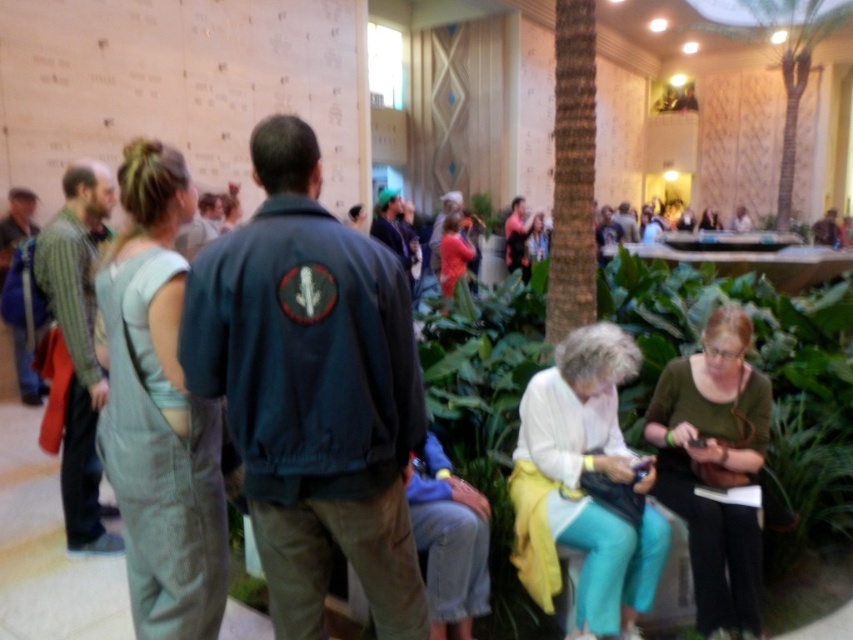
Question: Which object is the farthest from the green fabric purse at lower right?

Choices:
 (A) matte pink shirt at center
 (B) matte black camera at center
 (C) white matte sweater at center

Answer: (B)

Question: Does green fabric purse at lower right have a lesser width compared to matte pink shirt at center?

Choices:
 (A) no
 (B) yes

Answer: (A)

Question: Does light blue denim overalls at left appear under green fabric purse at lower right?

Choices:
 (A) no
 (B) yes

Answer: (A)

Question: Which object is positioned closest to the white matte sweater at center?

Choices:
 (A) light blue denim overalls at left
 (B) matte pink shirt at center
 (C) matte black camera at center

Answer: (A)

Question: Where is light blue denim overalls at left located in relation to matte black camera at center in the image?

Choices:
 (A) below
 (B) above

Answer: (A)

Question: Which point appears closest to the camera in this image?

Choices:
 (A) (186, 634)
 (B) (509, 266)

Answer: (A)